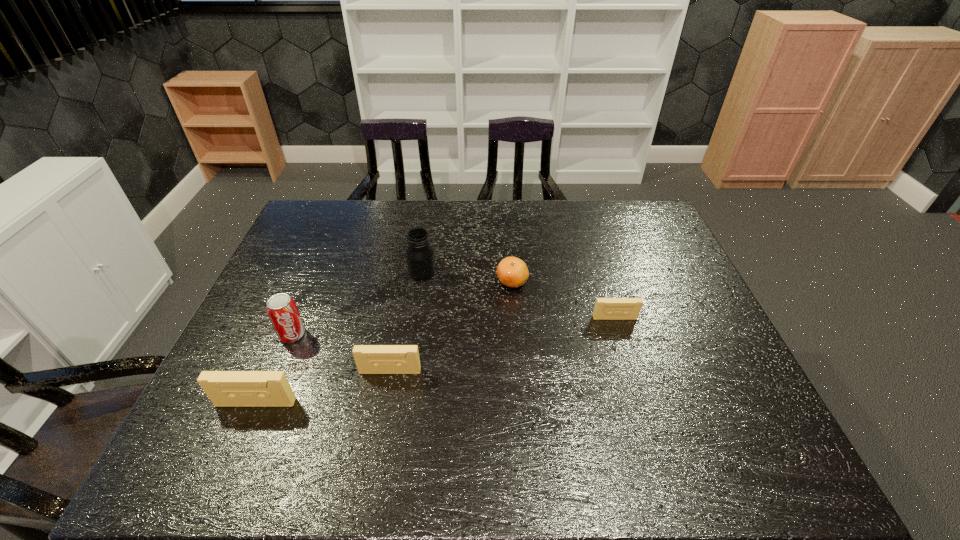
Where is `the nearest object`? the nearest object is located at coordinates (224, 388).

This screenshot has width=960, height=540. In order to click on the nearest videotape in this screenshot , I will do `click(224, 388)`.

This screenshot has height=540, width=960. Identify the location of the second videotape from right to left. (370, 359).

Locate an element on the screen. The height and width of the screenshot is (540, 960). the second nearest videotape is located at coordinates (370, 359).

Where is `the rightmost object`? This screenshot has height=540, width=960. the rightmost object is located at coordinates (605, 308).

The image size is (960, 540). Identify the location of the farthest videotape. (605, 308).

Identify the location of the third nearest object. (281, 308).

Find the location of a particular element. Image resolution: width=960 pixels, height=540 pixels. the fifth shortest object is located at coordinates 281,308.

Identify the location of clementine. Image resolution: width=960 pixels, height=540 pixels. (512, 272).

Find the location of a particular element. jar is located at coordinates (420, 255).